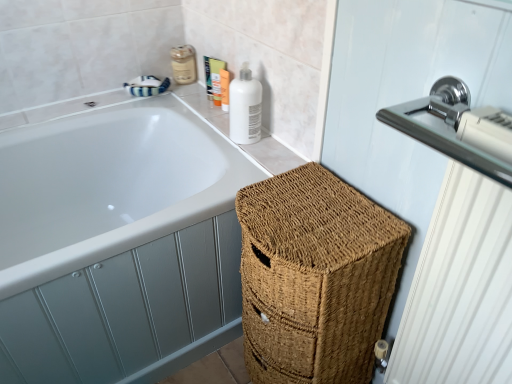
Question: From a real-world perspective, does white glossy bottle at upper right stand above matte white lotion at upper right, the 1th toiletry from the right?

Choices:
 (A) yes
 (B) no

Answer: (A)

Question: Is white glossy bottle at upper right placed right next to matte white lotion at upper right, the 1th toiletry from the right?

Choices:
 (A) yes
 (B) no

Answer: (A)

Question: From the image's perspective, would you say white glossy bottle at upper right is positioned over matte white lotion at upper right, arranged as the 4th toiletry when viewed from the left?

Choices:
 (A) no
 (B) yes

Answer: (A)

Question: Does white glossy bottle at upper right lie in front of matte white lotion at upper right, arranged as the 4th toiletry when viewed from the left?

Choices:
 (A) no
 (B) yes

Answer: (B)

Question: Considering the relative positions of white glossy bottle at upper right and matte white lotion at upper right, the 1th toiletry from the right, in the image provided, is white glossy bottle at upper right to the right of matte white lotion at upper right, the 1th toiletry from the right, from the viewer's perspective?

Choices:
 (A) yes
 (B) no

Answer: (A)

Question: In the image, is chrome metallic sink at upper right on the left side or the right side of braided wicker basket at lower right?

Choices:
 (A) right
 (B) left

Answer: (A)

Question: Considering the positions of chrome metallic sink at upper right and braided wicker basket at lower right in the image, is chrome metallic sink at upper right bigger or smaller than braided wicker basket at lower right?

Choices:
 (A) small
 (B) big

Answer: (A)

Question: Is point (461, 137) closer or farther from the camera than point (315, 193)?

Choices:
 (A) farther
 (B) closer

Answer: (B)

Question: Considering the positions of chrome metallic sink at upper right and braided wicker basket at lower right in the image, is chrome metallic sink at upper right taller or shorter than braided wicker basket at lower right?

Choices:
 (A) tall
 (B) short

Answer: (B)

Question: From the image's perspective, is chrome metallic sink at upper right positioned above or below white glossy bathtub at upper left?

Choices:
 (A) above
 (B) below

Answer: (A)

Question: Visually, is chrome metallic sink at upper right positioned to the left or to the right of white glossy bathtub at upper left?

Choices:
 (A) left
 (B) right

Answer: (B)

Question: Is chrome metallic sink at upper right situated inside white glossy bathtub at upper left or outside?

Choices:
 (A) inside
 (B) outside

Answer: (B)

Question: Is chrome metallic sink at upper right wider or thinner than white glossy bathtub at upper left?

Choices:
 (A) wide
 (B) thin

Answer: (B)

Question: From a real-world perspective, is polished chrome radiator at upper right positioned above or below chrome metallic sink at upper right?

Choices:
 (A) below
 (B) above

Answer: (A)

Question: In the image, is polished chrome radiator at upper right on the left side or the right side of chrome metallic sink at upper right?

Choices:
 (A) right
 (B) left

Answer: (A)